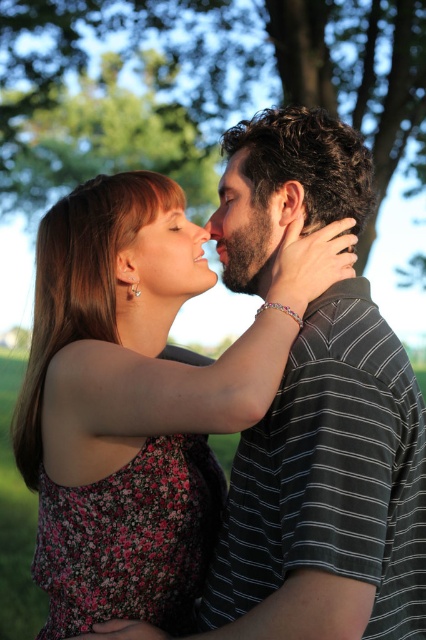
Which of these two, bearded man at center or matte skin at center, stands taller?

bearded man at center

Is point (232, 285) positioned in front of point (173, 214)?

Yes, it is.

Image resolution: width=426 pixels, height=640 pixels. I want to click on bearded man at center, so click(247, 227).

Locate an element on the screen. Image resolution: width=426 pixels, height=640 pixels. bearded man at center is located at coordinates (247, 227).

In the scene shown: Does matte skin at center appear on the left side of matte brown hair at upper center?

Yes, matte skin at center is to the left of matte brown hair at upper center.

Is point (164, 221) closer to camera compared to point (245, 168)?

No, (164, 221) is further to viewer.

Is point (121, 269) closer to viewer compared to point (238, 164)?

Yes, it is in front of point (238, 164).

I want to click on matte skin at center, so click(166, 259).

Between bearded man at center and matte brown hair at upper center, which one is positioned lower?

bearded man at center is below.

Who is higher up, bearded man at center or matte brown hair at upper center?

Positioned higher is matte brown hair at upper center.

Image resolution: width=426 pixels, height=640 pixels. What do you see at coordinates (247, 227) in the screenshot?
I see `bearded man at center` at bounding box center [247, 227].

The image size is (426, 640). I want to click on bearded man at center, so click(x=247, y=227).